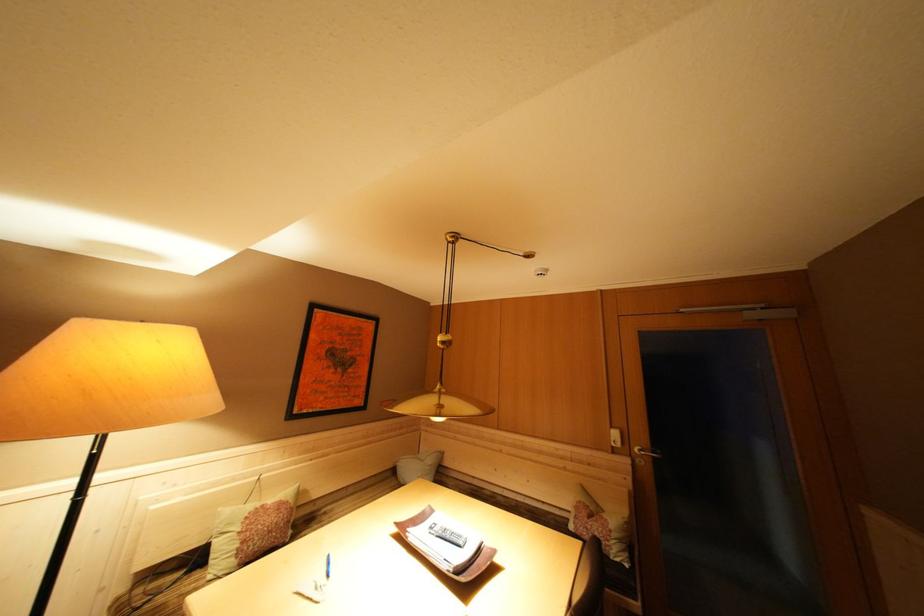
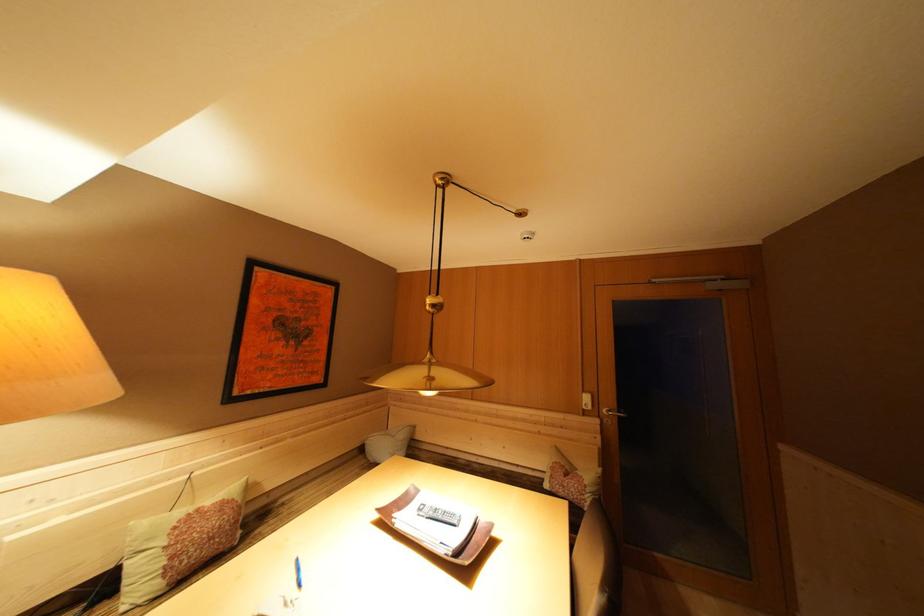
Question: How did the camera likely rotate?

Choices:
 (A) Left
 (B) Right
 (C) Up
 (D) Down

Answer: (B)